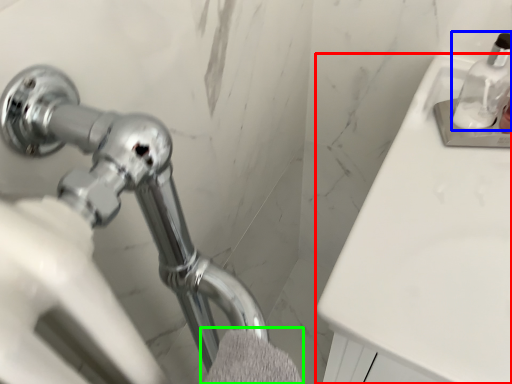
Question: Which is farther away from counter top (highlighted by a red box)? soap dispenser (highlighted by a blue box) or bath towel (highlighted by a green box)?

Choices:
 (A) soap dispenser
 (B) bath towel

Answer: (B)